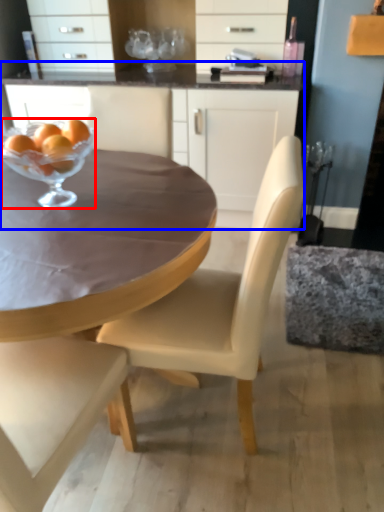
Question: Among these objects, which one is farthest to the camera, martini glass (highlighted by a red box) or cabinetry (highlighted by a blue box)?

Choices:
 (A) martini glass
 (B) cabinetry

Answer: (B)